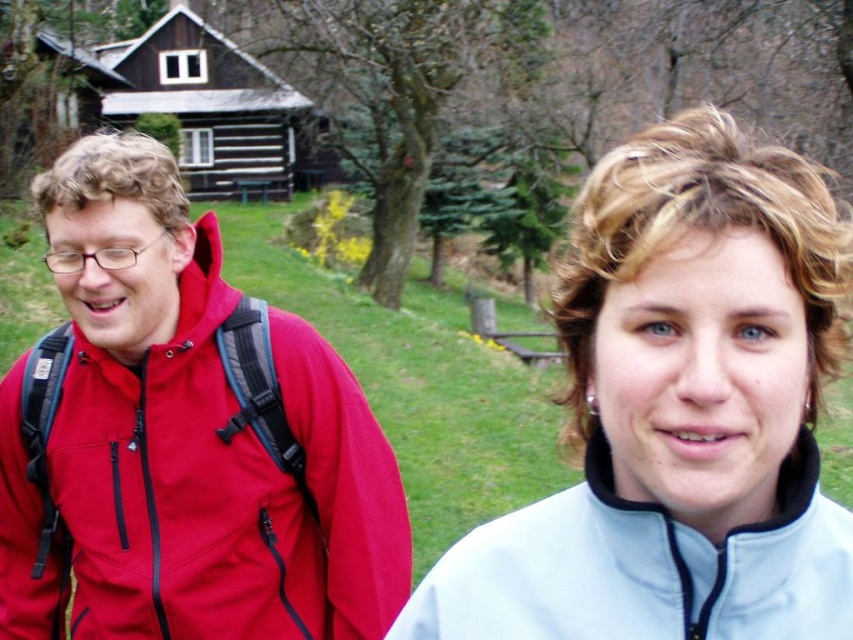
Consider the image. You are standing in front of two people wearing jackets. The light blue fleece jacket at center and the white fleece sweatshirt at center are both in front of you. Which jacket is located to the right?

The light blue fleece jacket at center is positioned to the right of the white fleece sweatshirt at center, so the light blue fleece jacket at center is on the right side.

You are standing at the starting point and see two points marked in the image. Which point is closer to you, point (674, 580) or point (608, 620)?

Point (674, 580) is in front of point (608, 620), so it is closer to you.

You are a photographer trying to capture both the light blue fleece jacket at center and the matte red jacket at left in a single frame. Given that your camera has a limited focus range, which jacket should you adjust your focus on to ensure both are in focus?

The light blue fleece jacket at center has a lesser width compared to matte red jacket at left. To ensure both are in focus, adjust the focus on the matte red jacket at left since it is wider and requires more focus range.